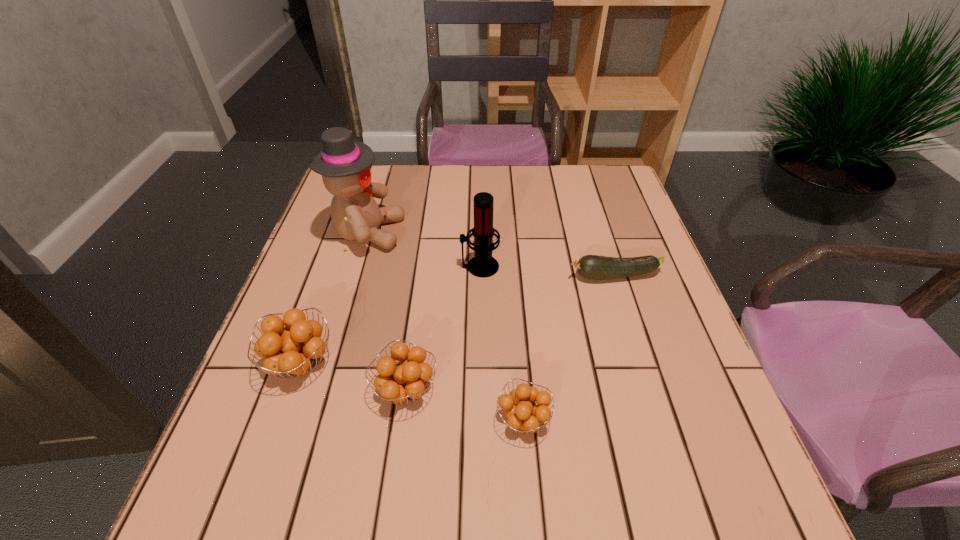
The image size is (960, 540). I want to click on the tallest orange fruit, so click(x=293, y=349).

The width and height of the screenshot is (960, 540). I want to click on the leftmost orange fruit, so click(293, 349).

Identify the location of the fourth object from right to left. (401, 383).

Identify the location of the fourth tallest object. [x=401, y=383].

Identify the location of the shortest orange fruit. click(x=526, y=417).

Where is `the second shortest object`? This screenshot has width=960, height=540. the second shortest object is located at coordinates (526, 417).

Identify the location of rag_doll. (345, 165).

Where is `the second tallest object`? the second tallest object is located at coordinates (483, 265).

Where is `zucchini`? zucchini is located at coordinates (594, 267).

Where is `the rightmost object`? Image resolution: width=960 pixels, height=540 pixels. the rightmost object is located at coordinates (594, 267).